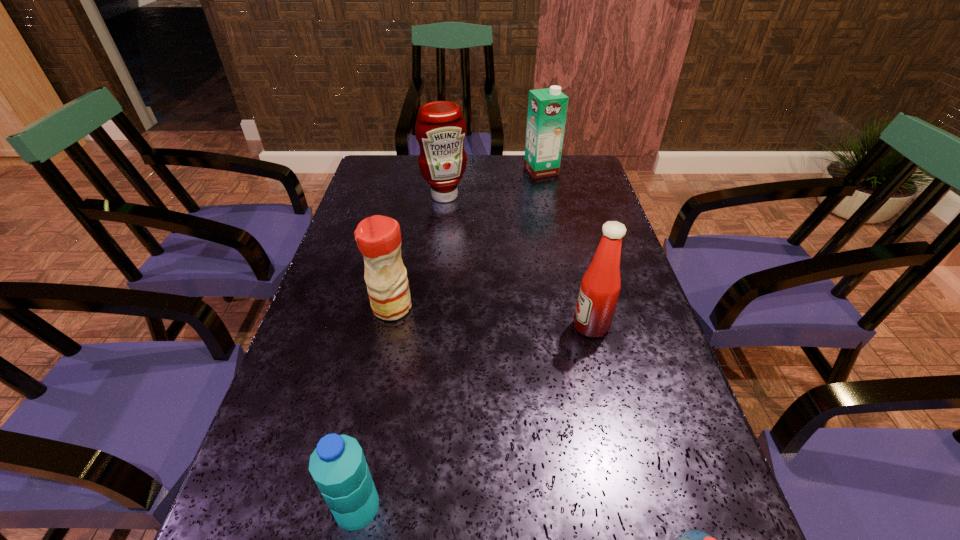
At what (x,y) coordinates should I click in order to perform the action: click on blank space at the far left corner of the desktop. Please return your answer as a coordinate pair (x, y). Looking at the image, I should click on (379, 185).

This screenshot has width=960, height=540. In order to click on free spot between the farthest condiment and the fifth tallest object in this screenshot , I will do `click(400, 352)`.

Identify the location of empty space between the second shortest object and the rightmost condiment. Image resolution: width=960 pixels, height=540 pixels. (473, 416).

Identify which object is the fourth nearest to the farthest object. Please provide its 2D coordinates. Your answer should be formatted as a tuple, i.e. [(x, y)], where the tuple contains the x and y coordinates of a point satisfying the conditions above.

[(338, 466)]

The height and width of the screenshot is (540, 960). In order to click on object that is the closest to the nearer water bottle in this screenshot , I will do `click(338, 466)`.

At what (x,y) coordinates should I click in order to perform the action: click on the second closest condiment to the second farthest object. Please return your answer as a coordinate pair (x, y). Looking at the image, I should click on (601, 283).

Identify which condiment is located as the nearest to the shortest object. Please provide its 2D coordinates. Your answer should be formatted as a tuple, i.e. [(x, y)], where the tuple contains the x and y coordinates of a point satisfying the conditions above.

[(601, 283)]

This screenshot has width=960, height=540. Find the location of `free space that satisfies the following two spatial constraints: 1. on the front-facing side of the rightmost condiment; 2. on the front side of the farther water bottle`. free space that satisfies the following two spatial constraints: 1. on the front-facing side of the rightmost condiment; 2. on the front side of the farther water bottle is located at coordinates (636, 507).